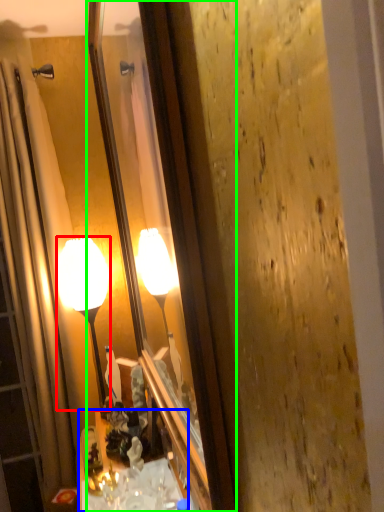
Question: Which is farther away from lamp (highlighted by a red box)? cabinetry (highlighted by a blue box) or mirror (highlighted by a green box)?

Choices:
 (A) cabinetry
 (B) mirror

Answer: (B)